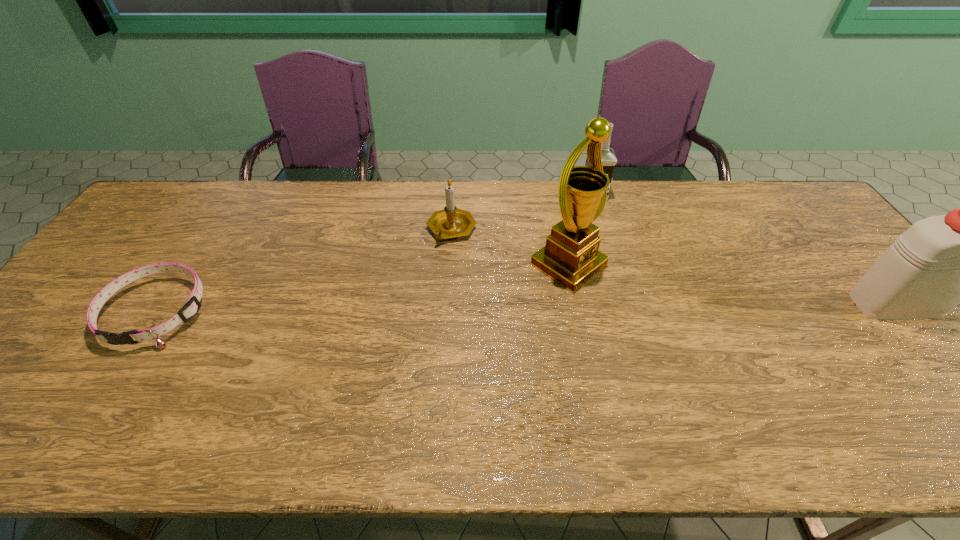
I want to click on vacant space located 0.300m on the front-facing side of the award, so click(x=703, y=352).

Find the location of a particular element. This screenshot has width=960, height=540. free space located 0.360m on the front-facing side of the award is located at coordinates (727, 367).

The width and height of the screenshot is (960, 540). What are the coordinates of `free space located 0.150m on the front-facing side of the award` in the screenshot? It's located at (648, 316).

The width and height of the screenshot is (960, 540). What are the coordinates of `vacant space located 0.210m with a handle on the candle holder` in the screenshot? It's located at (446, 302).

This screenshot has height=540, width=960. What are the coordinates of `free space located with a handle on the candle holder` in the screenshot? It's located at (446, 296).

Locate an element on the screen. Image resolution: width=960 pixels, height=540 pixels. vacant space situated 0.070m with a handle on the candle holder is located at coordinates (448, 265).

Image resolution: width=960 pixels, height=540 pixels. In order to click on free space located 0.300m on the front label of the vodka in this screenshot , I will do `click(614, 265)`.

The width and height of the screenshot is (960, 540). What are the coordinates of `vacant area situated on the front label of the vodka` in the screenshot? It's located at (599, 213).

Find the location of `free region located 0.070m on the front label of the vodka`. free region located 0.070m on the front label of the vodka is located at coordinates (600, 215).

I want to click on candle holder at the far edge, so click(x=450, y=222).